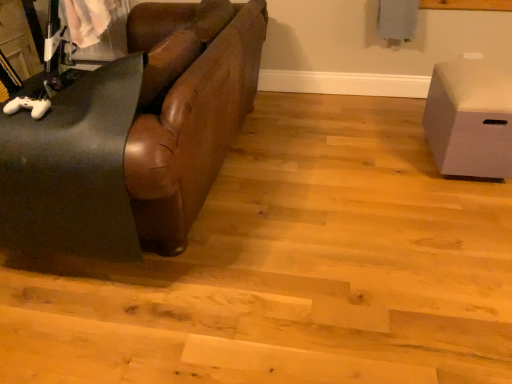
This screenshot has width=512, height=384. Identify the location of free location above white matte storage box at right (from a real-world perspective). (485, 68).